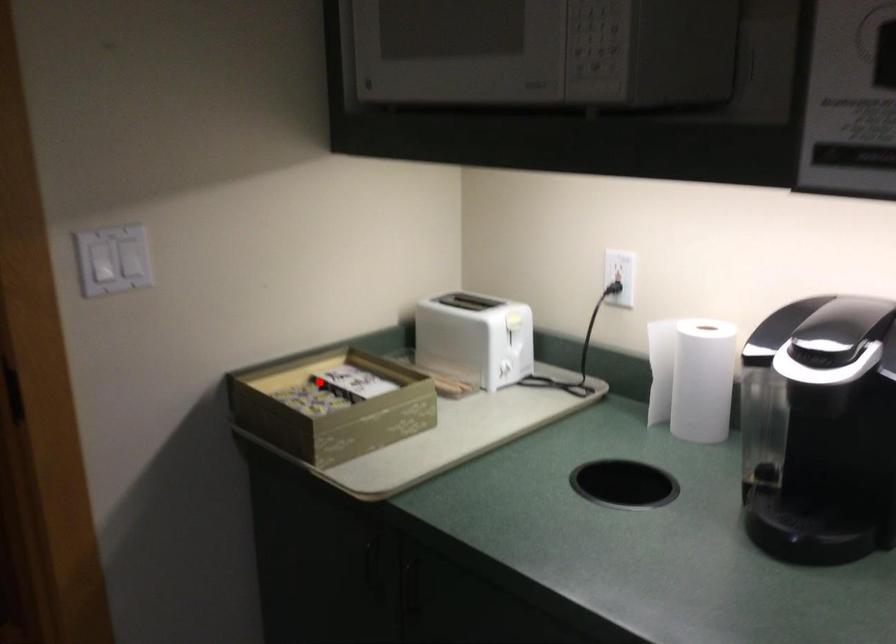
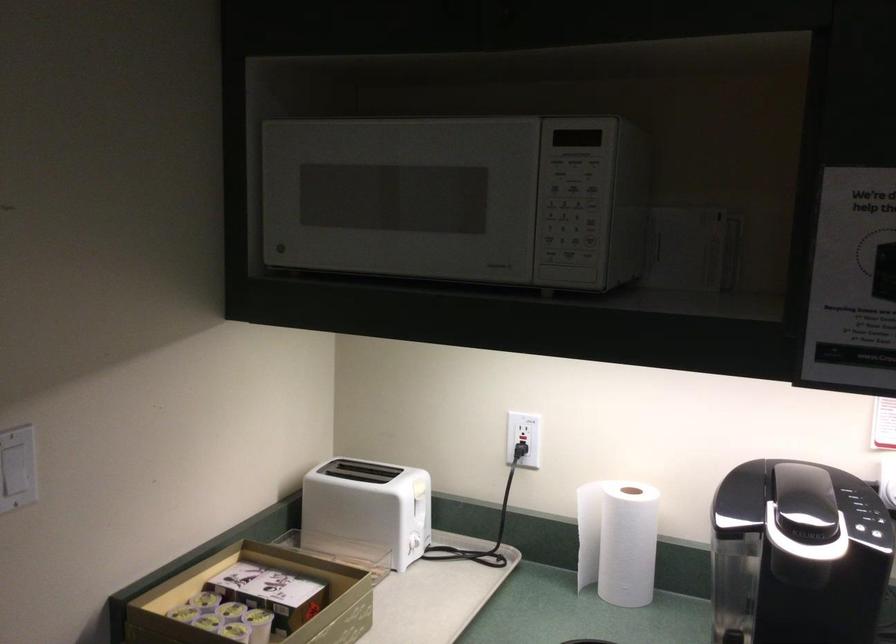
Question: I am providing you with two images of the same scene from different viewpoints. Image1 has a red point marked. In image2, the corresponding 3D location appears at what relative position? Reply with the corresponding letter.

Choices:
 (A) Closer
 (B) Farther

Answer: (A)